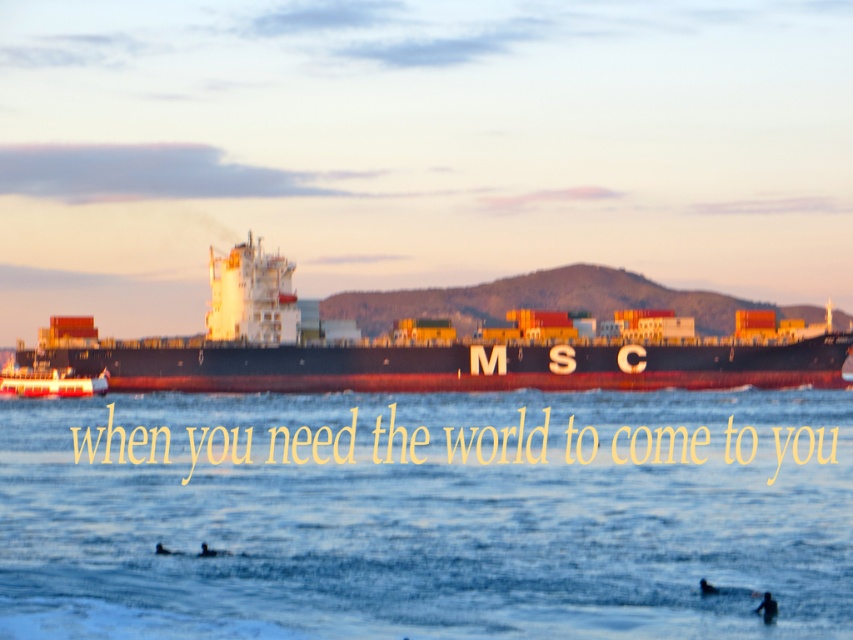
Is point (614, 352) more distant than point (1, 376)?

No.

Does point (708, 356) come closer to viewer compared to point (65, 388)?

Yes, point (708, 356) is in front of point (65, 388).

The width and height of the screenshot is (853, 640). What do you see at coordinates (409, 352) in the screenshot?
I see `black matte cargo ship at center` at bounding box center [409, 352].

Where is `black matte cargo ship at center`? Image resolution: width=853 pixels, height=640 pixels. black matte cargo ship at center is located at coordinates (409, 352).

Measure the distance between blue water at center and metallic red boat at left.

A distance of 40.24 meters exists between blue water at center and metallic red boat at left.

Can you confirm if blue water at center is shorter than metallic red boat at left?

Yes.

Which is behind, point (345, 500) or point (83, 385)?

Point (83, 385)

You are a GUI agent. You are given a task and a screenshot of the screen. Output one action in this format:
    pyautogui.click(x=<x>, y=<y>)
    Task: Click on the blue water at center
    This screenshot has height=640, width=853.
    Given the screenshot: What is the action you would take?
    click(425, 518)

Is point (793, 468) positioned after point (206, 362)?

No, (793, 468) is closer to viewer.

Between blue water at center and black matte cargo ship at center, which one appears on the right side from the viewer's perspective?

black matte cargo ship at center is more to the right.

Between point (701, 417) and point (288, 328), which one is positioned behind?

Positioned behind is point (288, 328).

Find the location of `blue water at center`. blue water at center is located at coordinates (425, 518).